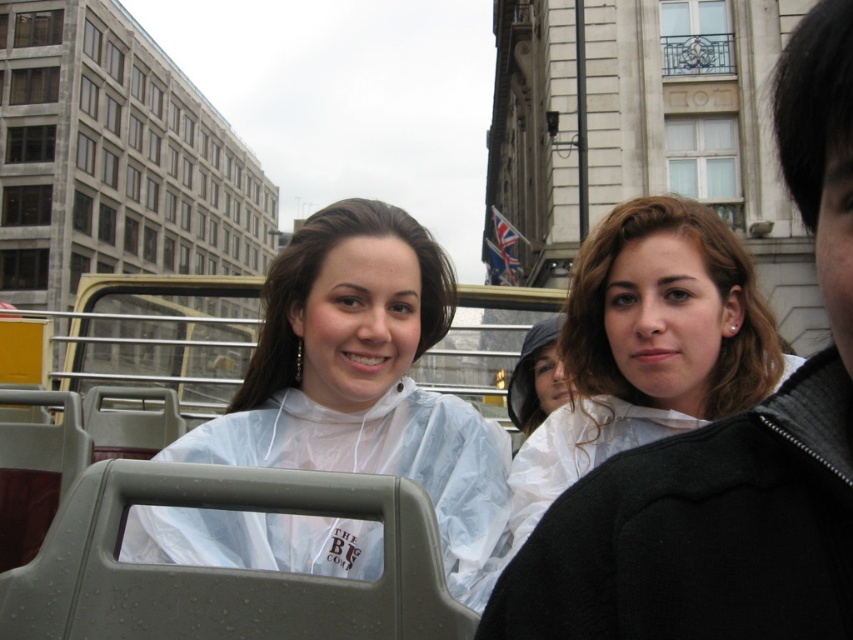
In the scene shown: You are a passenger on the open top tour bus and you see a point at coordinate (727, 451). Where is this point located?

The point at coordinate (727, 451) is located on the transparent plastic raincoat at center.

Based on the photo, where is the transparent plastic poncho at center located in the image?

The transparent plastic poncho at center is located at point (364, 380) in the image.